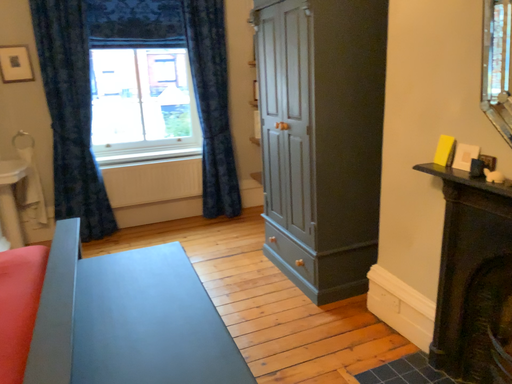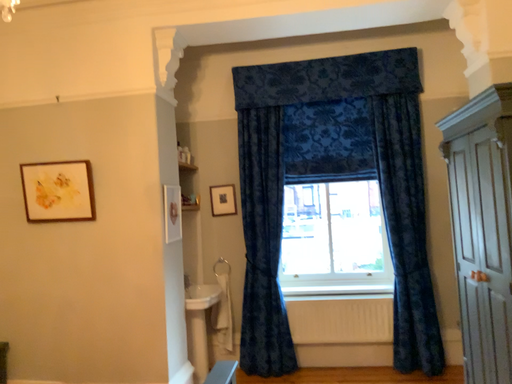
Question: Which way did the camera rotate in the video?

Choices:
 (A) rotated upward
 (B) rotated downward

Answer: (A)